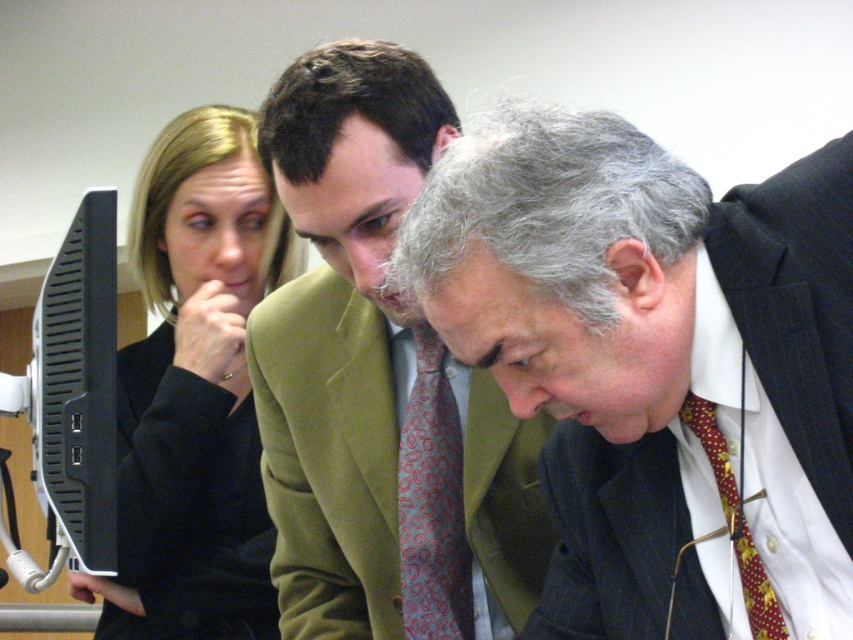
Question: Is dark blue pinstripe suit at lower right behind black wool business suit at left?

Choices:
 (A) no
 (B) yes

Answer: (A)

Question: Does dark blue pinstripe suit at lower right appear on the left side of black wool business suit at left?

Choices:
 (A) yes
 (B) no

Answer: (B)

Question: Among these objects, which one is nearest to the camera?

Choices:
 (A) black wool business suit at left
 (B) dark blue pinstripe suit at lower right
 (C) black plastic monitor at left

Answer: (B)

Question: Can you confirm if green fabric jacket at center is smaller than black fabric at left?

Choices:
 (A) no
 (B) yes

Answer: (B)

Question: Which of the following is the closest to the observer?

Choices:
 (A) green fabric jacket at center
 (B) black plastic monitor at left
 (C) dark blue pinstripe suit at lower right
 (D) black fabric at left

Answer: (C)

Question: Which of these objects is positioned farthest from the black wool business suit at left?

Choices:
 (A) black plastic monitor at left
 (B) green fabric jacket at center
 (C) black fabric at left
 (D) dark blue pinstripe suit at lower right

Answer: (D)